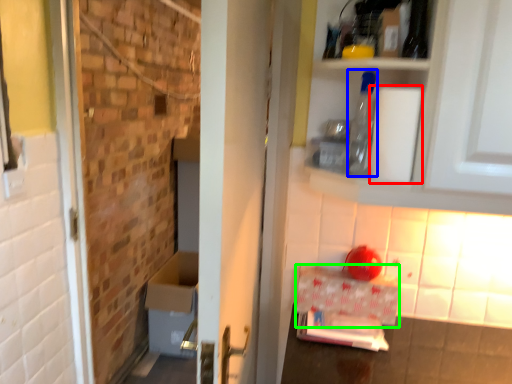
Question: Based on their relative distances, which object is nearer to toilet paper (highlighted by a red box)? Choose from bottle (highlighted by a blue box) and cardboard box (highlighted by a green box).

Choices:
 (A) bottle
 (B) cardboard box

Answer: (A)